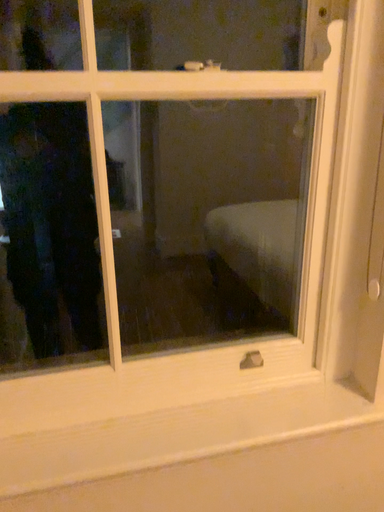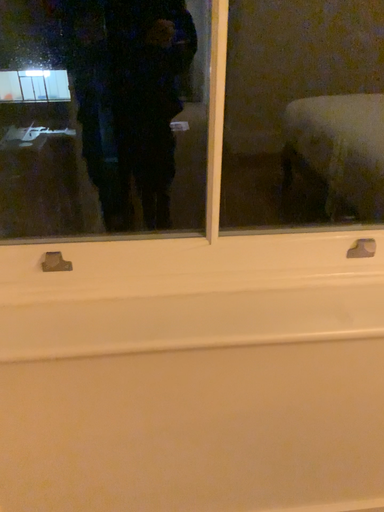
Question: Which way did the camera rotate in the video?

Choices:
 (A) rotated left
 (B) rotated right

Answer: (A)